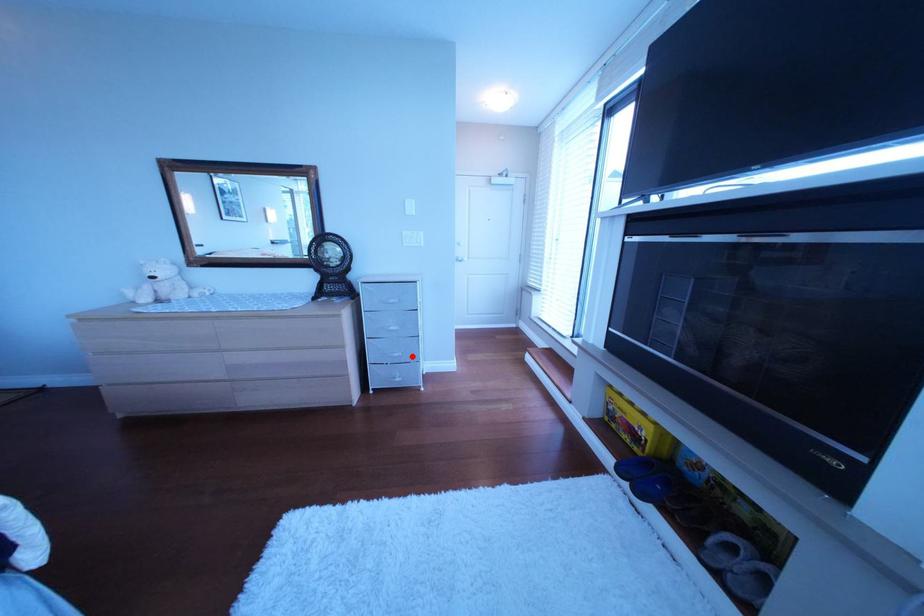
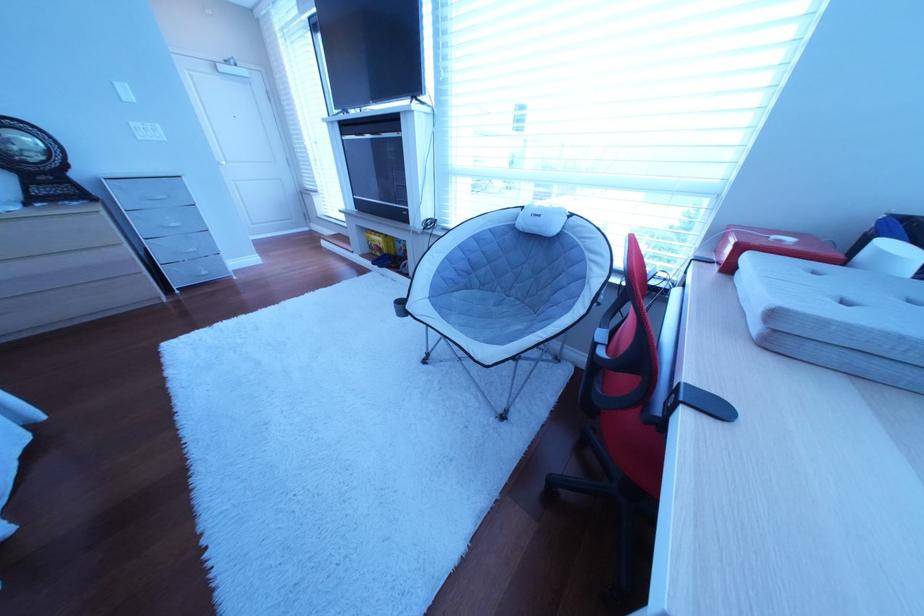
Where in the second image is the point corresponding to the highlighted location from the first image?

(207, 252)